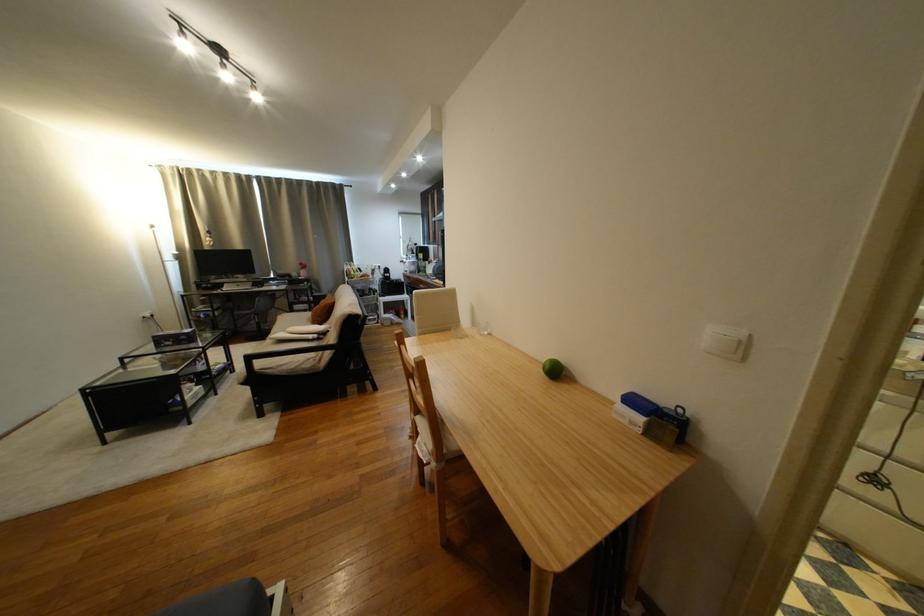
Where would you lift the small drinking glass? Please return your answer as a coordinate pair (x, y).

(480, 323)